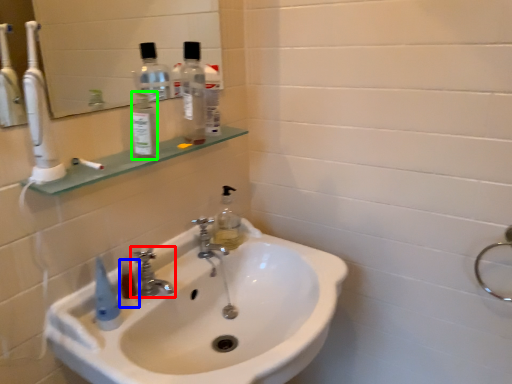
Question: Considering the real-world distances, which object is closest to tap (highlighted by a red box)? mouthwash (highlighted by a blue box) or bottle (highlighted by a green box).

Choices:
 (A) mouthwash
 (B) bottle

Answer: (A)